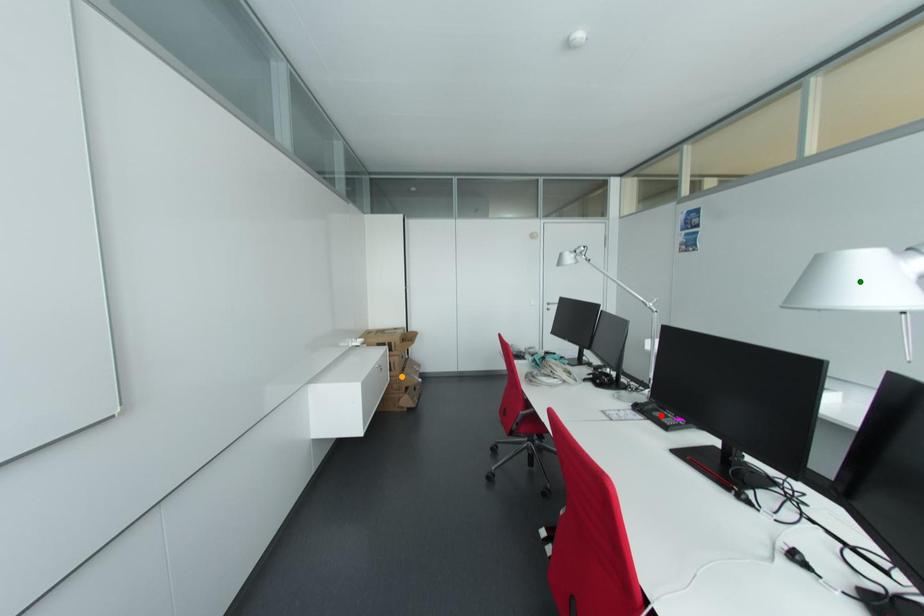
Order these from nearest to farthest:
orange point, red point, green point

green point, red point, orange point